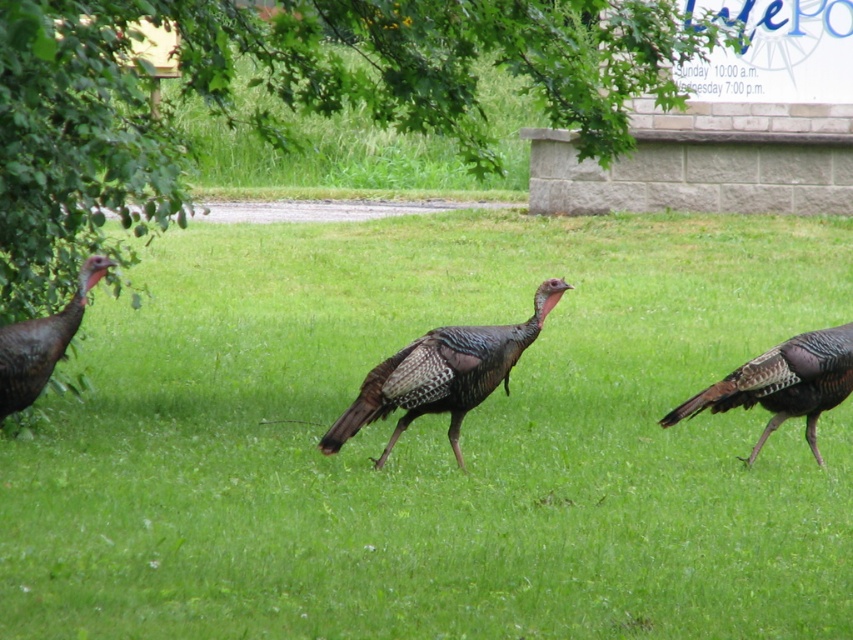
Where is `brown speckled turkey at center`? This screenshot has height=640, width=853. brown speckled turkey at center is located at coordinates (440, 374).

Which is behind, point (436, 404) or point (32, 324)?

The point (436, 404) is more distant.

This screenshot has height=640, width=853. I want to click on brown speckled turkey at center, so click(x=440, y=374).

Is brown feathered turkey at center shorter than brown feathered turkey at left?

Incorrect, brown feathered turkey at center's height does not fall short of brown feathered turkey at left's.

Does brown feathered turkey at center have a greater height compared to brown feathered turkey at left?

Yes, brown feathered turkey at center is taller than brown feathered turkey at left.

Who is more distant from viewer, (165, 564) or (19, 346)?

The point (19, 346) is behind.

Locate an element on the screen. This screenshot has height=640, width=853. brown feathered turkey at center is located at coordinates (439, 442).

Between brown speckled turkey at center and shiny brown turkey at center, which one appears on the right side from the viewer's perspective?

shiny brown turkey at center is more to the right.

How distant is brown speckled turkey at center from shiny brown turkey at center?

A distance of 1.18 meters exists between brown speckled turkey at center and shiny brown turkey at center.

Between point (428, 406) and point (838, 403), which one is positioned in front?

Positioned in front is point (428, 406).

Identify the location of brown speckled turkey at center. point(440,374).